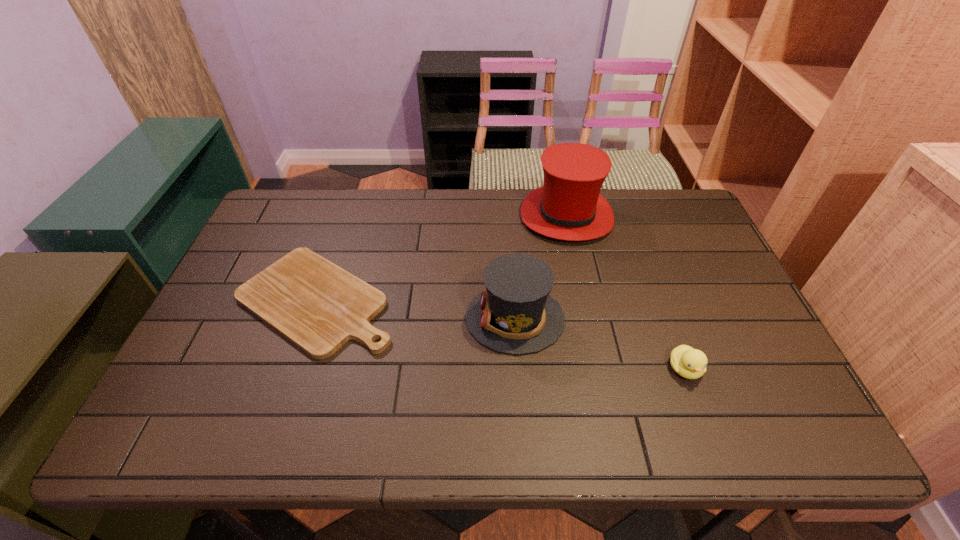
Where is `the tallest object`? The height and width of the screenshot is (540, 960). the tallest object is located at coordinates (569, 206).

At what (x,y) coordinates should I click in order to perform the action: click on the farther dress hat. Please return your answer as a coordinate pair (x, y). Image resolution: width=960 pixels, height=540 pixels. Looking at the image, I should click on (569, 206).

Find the location of a particular element. Image resolution: width=960 pixels, height=540 pixels. the nearer dress hat is located at coordinates (516, 315).

The height and width of the screenshot is (540, 960). Find the location of `the shorter dress hat`. the shorter dress hat is located at coordinates (516, 315).

The width and height of the screenshot is (960, 540). What are the coordinates of `the second shortest object` in the screenshot? It's located at (690, 363).

Locate an element on the screen. duckling is located at coordinates (690, 363).

The image size is (960, 540). In order to click on the leftmost object in this screenshot , I will do `click(317, 305)`.

The width and height of the screenshot is (960, 540). What are the coordinates of `the shortest object` in the screenshot? It's located at (317, 305).

Identify the location of free space located on the left of the taller dress hat. (450, 216).

At what (x,y) coordinates should I click in order to perform the action: click on free space located with goggles on the front of the nearer dress hat. Please return your answer as a coordinate pair (x, y). The height and width of the screenshot is (540, 960). Looking at the image, I should click on (381, 318).